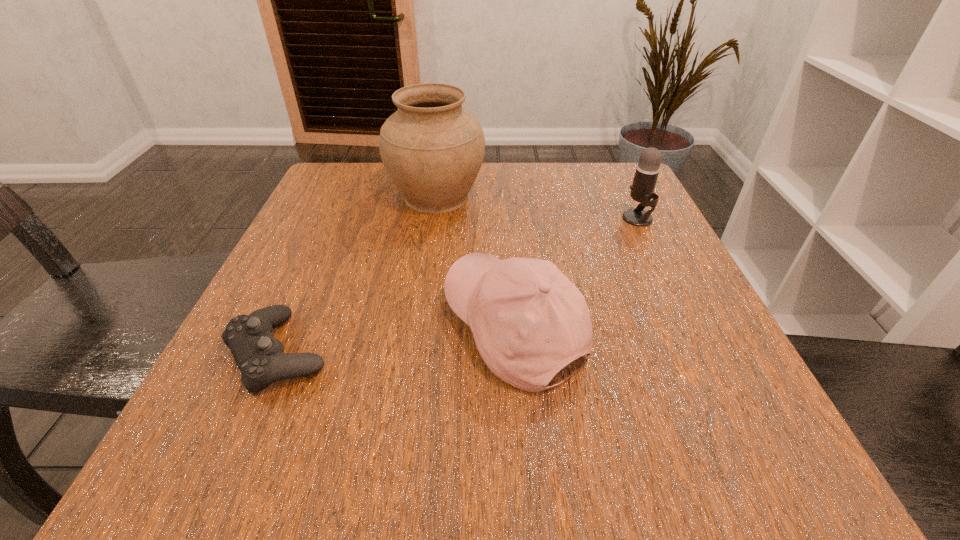
Locate an element on the screen. Image resolution: width=960 pixels, height=540 pixels. vacant space at the near right corner is located at coordinates [x=747, y=426].

Image resolution: width=960 pixels, height=540 pixels. Identify the location of vacant region between the urn and the leftmost object. (357, 275).

Where is `free point between the microphone and the third tallest object`? free point between the microphone and the third tallest object is located at coordinates (576, 274).

Where is `vacant region between the microphone and the baseball cap`? This screenshot has width=960, height=540. vacant region between the microphone and the baseball cap is located at coordinates (576, 274).

I want to click on blank region between the tallest object and the shortest object, so click(x=357, y=275).

This screenshot has height=540, width=960. Identify the location of free space between the shortest object and the baseball cap. (396, 341).

What are the coordinates of `free space between the third tallest object and the control` in the screenshot? It's located at (396, 341).

Identify the location of object that stands as the closest to the baseball cap. (258, 354).

This screenshot has width=960, height=540. Find the location of `the closest object relative to the third tallest object`. the closest object relative to the third tallest object is located at coordinates (258, 354).

Locate an element on the screen. This screenshot has height=540, width=960. free point that satisfies the following two spatial constraints: 1. on the back side of the urn; 2. on the right side of the control is located at coordinates (347, 197).